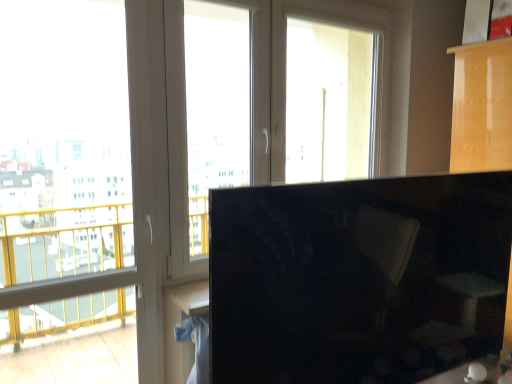
What do you see at coordinates (358, 278) in the screenshot?
I see `black glossy monitor at right` at bounding box center [358, 278].

How much space does transparent glass window at upper center, the first window screen in the right-to-left sequence, occupy horizontally?

It is 8.13 inches.

Locate an element on the screen. transparent glass window at center, acting as the second window screen starting from the left is located at coordinates (215, 107).

The width and height of the screenshot is (512, 384). Identify the location of the 2nd window screen located above the black glossy monitor at right (from a real-world perspective). (215, 107).

Could you tell me if black glossy monitor at right is turned towards transparent glass window at center, the second window screen when ordered from right to left?

No, black glossy monitor at right is not facing towards transparent glass window at center, the second window screen when ordered from right to left.

From the image's perspective, which object appears higher, black glossy monitor at right or transparent glass window at center, the second window screen when ordered from right to left?

transparent glass window at center, the second window screen when ordered from right to left, from the image's perspective.

Does black glossy monitor at right come behind transparent glass window at center, the second window screen when ordered from right to left?

No, black glossy monitor at right is closer to the viewer.

Between transparent glass window at center, acting as the second window screen starting from the left, and black glossy monitor at right, which one has smaller size?

With smaller size is transparent glass window at center, acting as the second window screen starting from the left.

From the image's perspective, count 2nd window screens upward from the black glossy monitor at right and point to it. Please provide its 2D coordinates.

[(215, 107)]

Is transparent glass window at center, the second window screen when ordered from right to left, directly adjacent to black glossy monitor at right?

No, transparent glass window at center, the second window screen when ordered from right to left, is not touching black glossy monitor at right.

From a real-world perspective, is transparent glass window at upper center, the third window screen positioned from the left, above or below transparent glass window at center, acting as the second window screen starting from the left?

Clearly, from a real-world perspective, transparent glass window at upper center, the third window screen positioned from the left, is above transparent glass window at center, acting as the second window screen starting from the left.

Which of these two, transparent glass window at upper center, the first window screen in the right-to-left sequence, or transparent glass window at center, the second window screen when ordered from right to left, is smaller?

With smaller size is transparent glass window at center, the second window screen when ordered from right to left.

Is point (322, 164) in front of point (196, 254)?

No, (322, 164) is further to viewer.

Is transparent glass window at left, the third window screen viewed from the right, wider or thinner than transparent glass window at upper center, the third window screen positioned from the left?

Considering their sizes, transparent glass window at left, the third window screen viewed from the right, looks slimmer than transparent glass window at upper center, the third window screen positioned from the left.

Choose the correct answer: Is transparent glass window at left, the third window screen viewed from the right, inside transparent glass window at upper center, the first window screen in the right-to-left sequence, or outside it?

transparent glass window at left, the third window screen viewed from the right, is not enclosed by transparent glass window at upper center, the first window screen in the right-to-left sequence.

Relative to transparent glass window at upper center, the first window screen in the right-to-left sequence, is transparent glass window at left, which ranks as the first window screen in left-to-right order, in front or behind?

In the image, transparent glass window at left, which ranks as the first window screen in left-to-right order, appears in front of transparent glass window at upper center, the first window screen in the right-to-left sequence.

In the scene shown: From a real-world perspective, relative to transparent glass window at upper center, the third window screen positioned from the left, is transparent glass window at left, which ranks as the first window screen in left-to-right order, vertically above or below?

transparent glass window at left, which ranks as the first window screen in left-to-right order, is below transparent glass window at upper center, the third window screen positioned from the left.

From the image's perspective, which one is positioned lower, transparent glass window at left, the third window screen viewed from the right, or black glossy monitor at right?

black glossy monitor at right appears lower in the image.

Can you confirm if transparent glass window at left, which ranks as the first window screen in left-to-right order, is wider than black glossy monitor at right?

No.

The height and width of the screenshot is (384, 512). Find the location of `the 2nd window screen to the left of the black glossy monitor at right, counting from the anchor's position`. the 2nd window screen to the left of the black glossy monitor at right, counting from the anchor's position is located at coordinates [64, 141].

Does transparent glass window at upper center, the first window screen in the right-to-left sequence, have a greater width compared to black glossy monitor at right?

No, transparent glass window at upper center, the first window screen in the right-to-left sequence, is not wider than black glossy monitor at right.

Would you say black glossy monitor at right is part of transparent glass window at upper center, the third window screen positioned from the left,'s contents?

No, black glossy monitor at right is not inside transparent glass window at upper center, the third window screen positioned from the left.

From the image's perspective, which is above, transparent glass window at upper center, the first window screen in the right-to-left sequence, or black glossy monitor at right?

transparent glass window at upper center, the first window screen in the right-to-left sequence, appears higher in the image.

Between transparent glass window at upper center, the third window screen positioned from the left, and black glossy monitor at right, which one has less height?

With less height is black glossy monitor at right.

Does black glossy monitor at right have a greater height compared to transparent glass window at upper center, the third window screen positioned from the left?

No, black glossy monitor at right is not taller than transparent glass window at upper center, the third window screen positioned from the left.

Considering their positions, is black glossy monitor at right located in front of or behind transparent glass window at upper center, the third window screen positioned from the left?

Clearly, black glossy monitor at right is in front of transparent glass window at upper center, the third window screen positioned from the left.

Find the location of a particular element. The width and height of the screenshot is (512, 384). computer monitor below the transparent glass window at upper center, the first window screen in the right-to-left sequence (from the image's perspective) is located at coordinates (358, 278).

From a real-world perspective, which is physically below, black glossy monitor at right or transparent glass window at upper center, the third window screen positioned from the left?

black glossy monitor at right.

Locate an element on the screen. the 2nd window screen above the black glossy monitor at right (from a real-world perspective) is located at coordinates (215, 107).

At what (x,y) coordinates should I click in order to perform the action: click on computer monitor lying below the transparent glass window at center, the second window screen when ordered from right to left (from the image's perspective). Please return your answer as a coordinate pair (x, y). The height and width of the screenshot is (384, 512). Looking at the image, I should click on (358, 278).

From the picture: Which object lies nearer to the anchor point transparent glass window at upper center, the first window screen in the right-to-left sequence, transparent glass window at left, which ranks as the first window screen in left-to-right order, or black glossy monitor at right?

black glossy monitor at right is positioned closer to the anchor transparent glass window at upper center, the first window screen in the right-to-left sequence.

When comparing their distances from transparent glass window at center, acting as the second window screen starting from the left, does transparent glass window at upper center, the third window screen positioned from the left, or transparent glass window at left, which ranks as the first window screen in left-to-right order, seem closer?

Based on the image, transparent glass window at left, which ranks as the first window screen in left-to-right order, appears to be nearer to transparent glass window at center, acting as the second window screen starting from the left.

Estimate the real-world distances between objects in this image. Which object is closer to transparent glass window at center, the second window screen when ordered from right to left, transparent glass window at left, which ranks as the first window screen in left-to-right order, or transparent glass window at upper center, the first window screen in the right-to-left sequence?

transparent glass window at left, which ranks as the first window screen in left-to-right order, is closer to transparent glass window at center, the second window screen when ordered from right to left.

From the image, which object appears to be nearer to transparent glass window at upper center, the third window screen positioned from the left, transparent glass window at left, the third window screen viewed from the right, or transparent glass window at center, the second window screen when ordered from right to left?

transparent glass window at center, the second window screen when ordered from right to left.

Based on their spatial positions, is transparent glass window at center, acting as the second window screen starting from the left, or black glossy monitor at right closer to transparent glass window at upper center, the third window screen positioned from the left?

transparent glass window at center, acting as the second window screen starting from the left.

Based on their spatial positions, is black glossy monitor at right or transparent glass window at center, acting as the second window screen starting from the left, closer to transparent glass window at upper center, the third window screen positioned from the left?

The object closer to transparent glass window at upper center, the third window screen positioned from the left, is transparent glass window at center, acting as the second window screen starting from the left.

Considering their positions, is transparent glass window at center, the second window screen when ordered from right to left, positioned further to black glossy monitor at right than transparent glass window at upper center, the first window screen in the right-to-left sequence?

transparent glass window at upper center, the first window screen in the right-to-left sequence, lies further to black glossy monitor at right than the other object.

Estimate the real-world distances between objects in this image. Which object is further from transparent glass window at center, the second window screen when ordered from right to left, transparent glass window at upper center, the third window screen positioned from the left, or black glossy monitor at right?

black glossy monitor at right.

Identify the location of computer monitor situated between transparent glass window at left, which ranks as the first window screen in left-to-right order, and transparent glass window at upper center, the first window screen in the right-to-left sequence, from left to right. click(358, 278).

Identify the location of window screen situated between transparent glass window at left, the third window screen viewed from the right, and black glossy monitor at right from left to right. This screenshot has width=512, height=384. point(215,107).

This screenshot has height=384, width=512. I want to click on window screen between transparent glass window at left, which ranks as the first window screen in left-to-right order, and transparent glass window at upper center, the first window screen in the right-to-left sequence, so click(x=215, y=107).